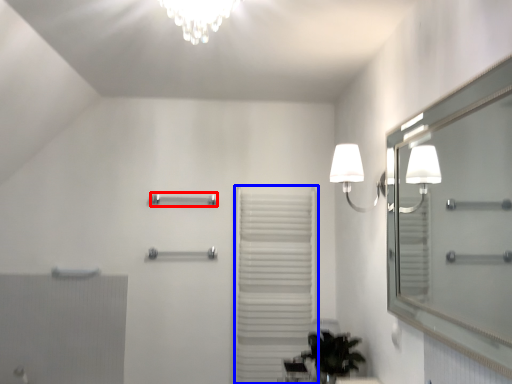
Question: Which point is further to the camera, towel bar (highlighted by a red box) or curtain (highlighted by a blue box)?

Choices:
 (A) towel bar
 (B) curtain

Answer: (A)